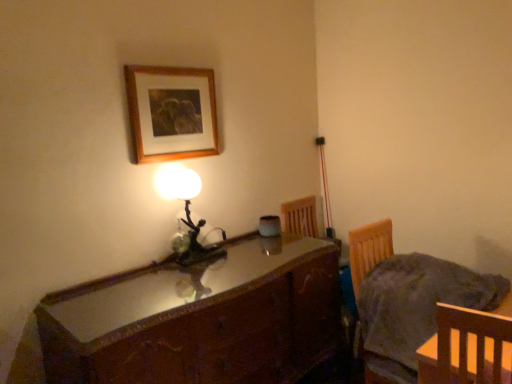
Question: Does matte glass lamp at center have a greater height compared to wooden picture frame at upper center?

Choices:
 (A) yes
 (B) no

Answer: (A)

Question: From the image's perspective, is matte glass lamp at center located beneath wooden picture frame at upper center?

Choices:
 (A) yes
 (B) no

Answer: (A)

Question: Is matte glass lamp at center not within wooden picture frame at upper center?

Choices:
 (A) yes
 (B) no

Answer: (A)

Question: Does matte glass lamp at center have a smaller size compared to wooden picture frame at upper center?

Choices:
 (A) no
 (B) yes

Answer: (A)

Question: Is matte glass lamp at center positioned behind wooden picture frame at upper center?

Choices:
 (A) no
 (B) yes

Answer: (B)

Question: Is wooden chair at lower right to the left or to the right of matte glass lamp at center in the image?

Choices:
 (A) right
 (B) left

Answer: (A)

Question: From their relative heights in the image, would you say wooden chair at lower right is taller or shorter than matte glass lamp at center?

Choices:
 (A) short
 (B) tall

Answer: (A)

Question: From a real-world perspective, is wooden chair at lower right positioned above or below matte glass lamp at center?

Choices:
 (A) above
 (B) below

Answer: (B)

Question: Looking at their shapes, would you say wooden chair at lower right is wider or thinner than matte glass lamp at center?

Choices:
 (A) wide
 (B) thin

Answer: (A)

Question: Do you think shiny brown wooden desk at center is within matte glass lamp at center, or outside of it?

Choices:
 (A) outside
 (B) inside

Answer: (A)

Question: In terms of width, does shiny brown wooden desk at center look wider or thinner when compared to matte glass lamp at center?

Choices:
 (A) thin
 (B) wide

Answer: (B)

Question: Is point (276, 238) closer or farther from the camera than point (194, 246)?

Choices:
 (A) closer
 (B) farther

Answer: (B)

Question: Based on their positions, is shiny brown wooden desk at center located to the left or right of matte glass lamp at center?

Choices:
 (A) right
 (B) left

Answer: (A)

Question: Considering the positions of point (201, 69) and point (361, 248), is point (201, 69) closer or farther from the camera than point (361, 248)?

Choices:
 (A) closer
 (B) farther

Answer: (B)

Question: Is wooden picture frame at upper center wider or thinner than wooden chair at lower right?

Choices:
 (A) wide
 (B) thin

Answer: (B)